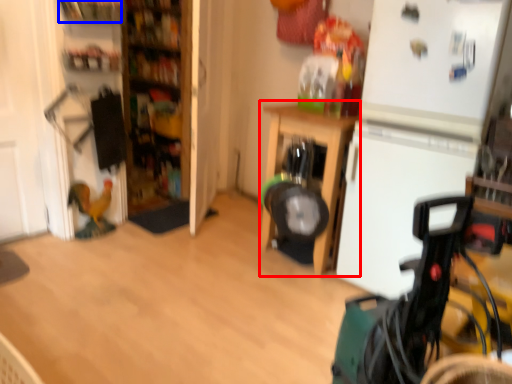
Question: Which object is closer to the camera taking this photo, furniture (highlighted by a red box) or shelf (highlighted by a blue box)?

Choices:
 (A) furniture
 (B) shelf

Answer: (A)